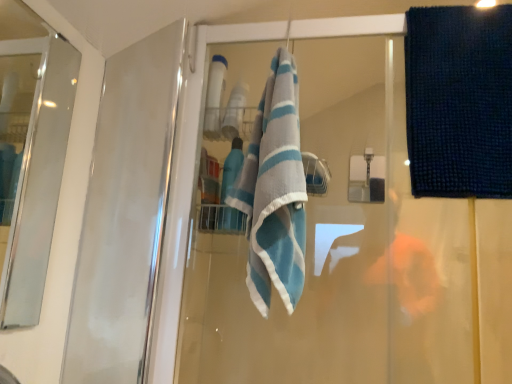
Question: Is blue striped towel at center bigger or smaller than clear glass screen door at left?

Choices:
 (A) big
 (B) small

Answer: (A)

Question: From the image's perspective, is blue striped towel at center positioned above or below clear glass screen door at left?

Choices:
 (A) below
 (B) above

Answer: (B)

Question: Estimate the real-world distances between objects in this image. Which object is closer to the dark blue textured towel at upper right?

Choices:
 (A) blue striped towel at center
 (B) clear glass screen door at left

Answer: (A)

Question: Estimate the real-world distances between objects in this image. Which object is closer to the dark blue textured towel at upper right?

Choices:
 (A) clear glass screen door at left
 (B) blue striped towel at center

Answer: (B)